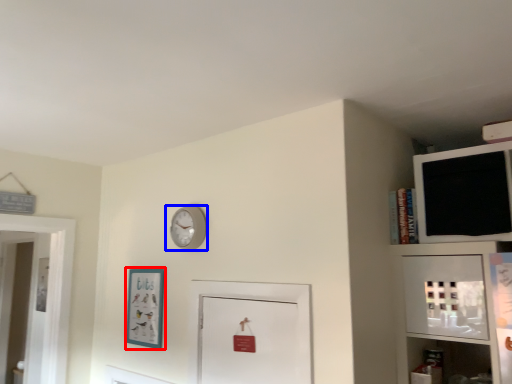
Question: Which object appears closest to the camera in this image, picture frame (highlighted by a red box) or wall clock (highlighted by a blue box)?

Choices:
 (A) picture frame
 (B) wall clock

Answer: (B)